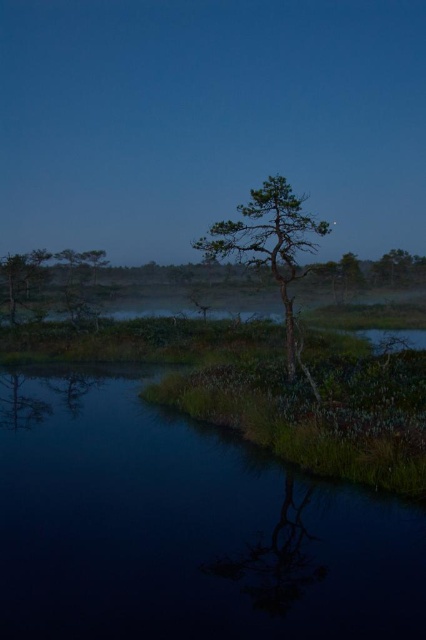
Question: Is green matte tree at center thinner than green mossy shrub at lower left?

Choices:
 (A) yes
 (B) no

Answer: (A)

Question: Which object appears farthest from the camera in this image?

Choices:
 (A) green mossy shrub at lower left
 (B) green matte tree at center
 (C) green matte tree at left
 (D) transparent water at lower center

Answer: (C)

Question: Which object is positioned closest to the green mossy shrub at lower left?

Choices:
 (A) transparent water at lower center
 (B) green matte tree at left

Answer: (B)

Question: In this image, where is transparent water at lower center located relative to green matte tree at center?

Choices:
 (A) right
 (B) left

Answer: (B)

Question: In this image, where is transparent water at lower center located relative to green matte tree at center?

Choices:
 (A) below
 (B) above

Answer: (A)

Question: Which point is farther to the camera?

Choices:
 (A) transparent water at lower center
 (B) green matte tree at left
 (C) green mossy shrub at lower left

Answer: (B)